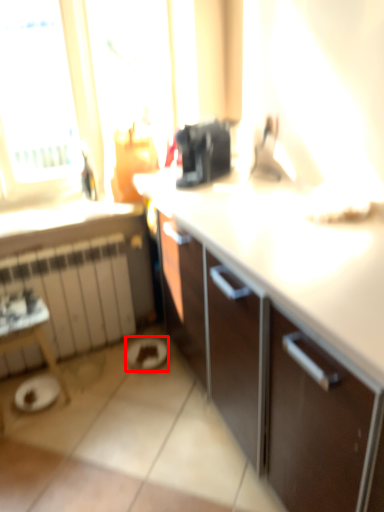
Question: From the image's perspective, considering the relative positions of manhole (annotated by the red box) and radiator in the image provided, where is manhole (annotated by the red box) located with respect to the staircase?

Choices:
 (A) above
 (B) below

Answer: (B)